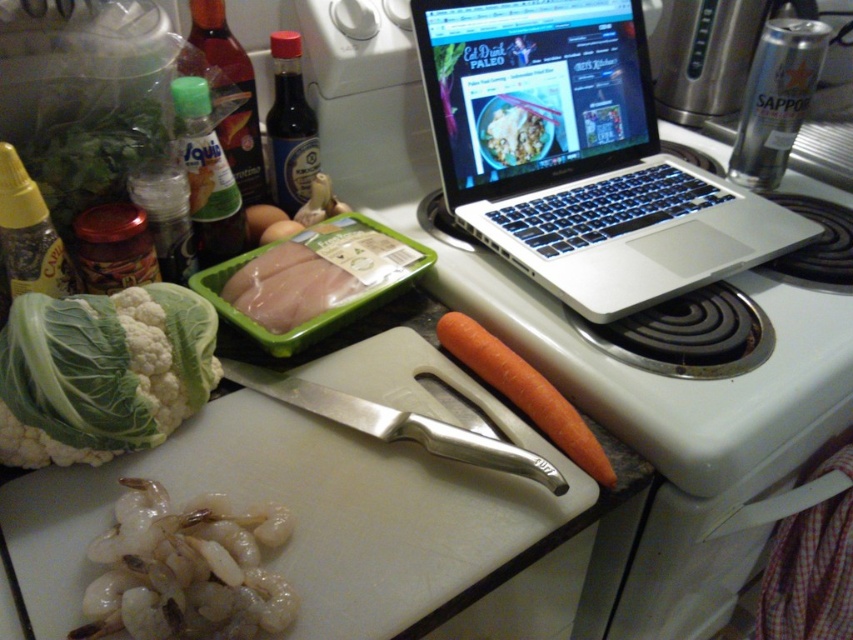
Who is taller, green leafy cabbage at left or orange smooth carrot at center?

green leafy cabbage at left

Measure the distance between green leafy cabbage at left and orange smooth carrot at center.

green leafy cabbage at left and orange smooth carrot at center are 11.86 inches apart from each other.

Does point (90, 456) come in front of point (490, 362)?

That is True.

Locate an element on the screen. The height and width of the screenshot is (640, 853). green leafy cabbage at left is located at coordinates (102, 372).

Between green leafy cabbage at left and smooth white rice bowl at center, which one appears on the right side from the viewer's perspective?

smooth white rice bowl at center

The width and height of the screenshot is (853, 640). What do you see at coordinates (102, 372) in the screenshot?
I see `green leafy cabbage at left` at bounding box center [102, 372].

Image resolution: width=853 pixels, height=640 pixels. In order to click on green leafy cabbage at left in this screenshot , I will do `click(102, 372)`.

Is white ceramic stove at upper right positioned before silver metallic knife at center?

That is False.

Which of these two, white ceramic stove at upper right or silver metallic knife at center, stands shorter?

With less height is silver metallic knife at center.

Where is `white ceramic stove at upper right`? This screenshot has height=640, width=853. white ceramic stove at upper right is located at coordinates (670, 365).